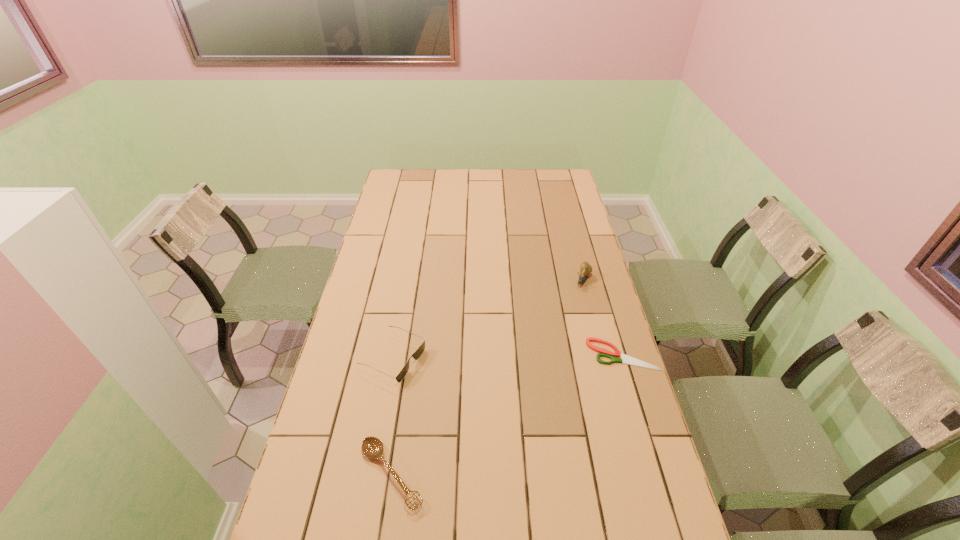
Identify the location of free space that is in between the scissors and the escargot. (603, 318).

The height and width of the screenshot is (540, 960). Find the location of `empty space that is in between the scissors and the nearest object`. empty space that is in between the scissors and the nearest object is located at coordinates (507, 414).

The width and height of the screenshot is (960, 540). Identify the location of free space that is in between the tallest object and the third tallest object. (488, 377).

The image size is (960, 540). In order to click on vacant space that is in between the escargot and the shortest object in this screenshot , I will do `click(603, 318)`.

The height and width of the screenshot is (540, 960). Find the location of `unoccupied area between the sunglasses and the third tallest object`. unoccupied area between the sunglasses and the third tallest object is located at coordinates (393, 416).

This screenshot has width=960, height=540. In order to click on the second closest object to the scissors in this screenshot , I will do `click(416, 355)`.

Find the location of `object identified as the third closest to the escargot`. object identified as the third closest to the escargot is located at coordinates (372, 447).

Find the location of a particular element. The image size is (960, 540). vacant region that satisfies the following two spatial constraints: 1. on the back side of the nearest object; 2. on the left side of the shortest object is located at coordinates click(410, 355).

Identify the location of vacant space that satisfies the following two spatial constraints: 1. on the back side of the farthest object; 2. on the left side of the nearest object. (420, 280).

I want to click on vacant region that satisfies the following two spatial constraints: 1. on the back side of the escargot; 2. on the left side of the third shortest object, so click(407, 280).